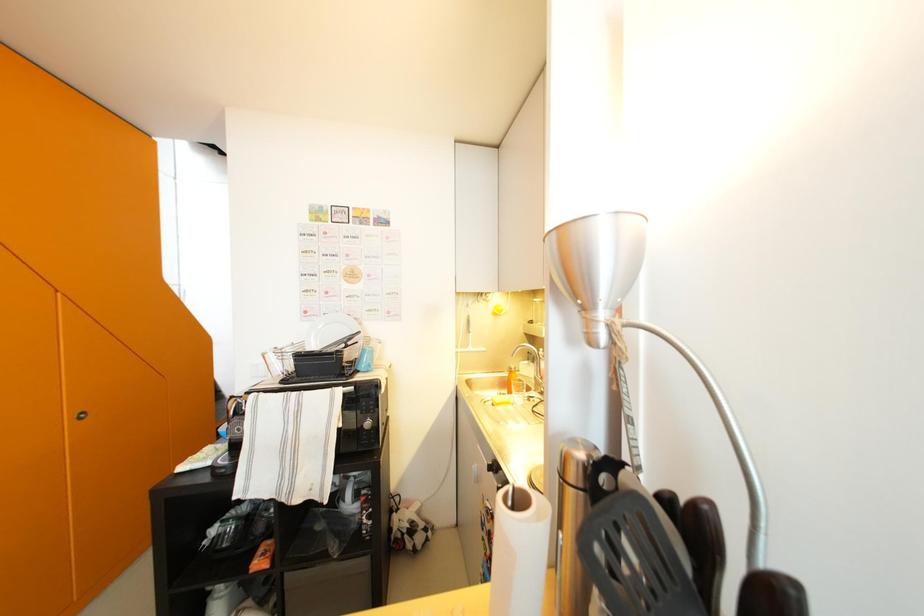
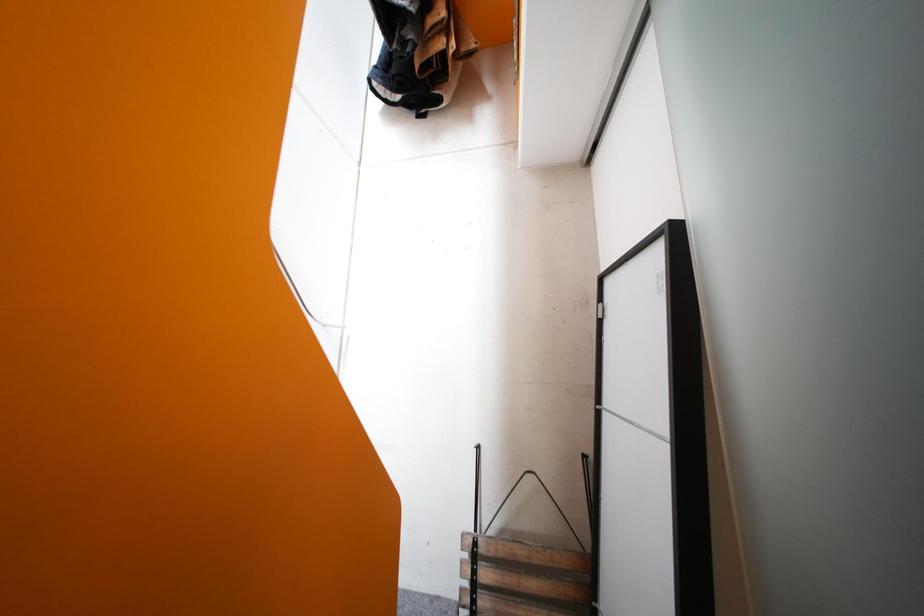
Which direction would the cameraman need to move to produce the second image?

The cameraman moved toward left, forward.